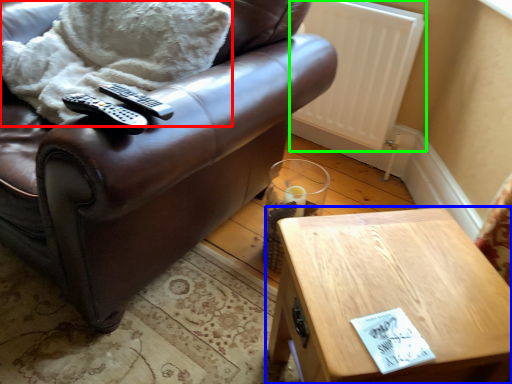
Question: Which is nearer to the blanket (highlighted by a red box)? table (highlighted by a blue box) or radiator (highlighted by a green box).

Choices:
 (A) table
 (B) radiator

Answer: (B)